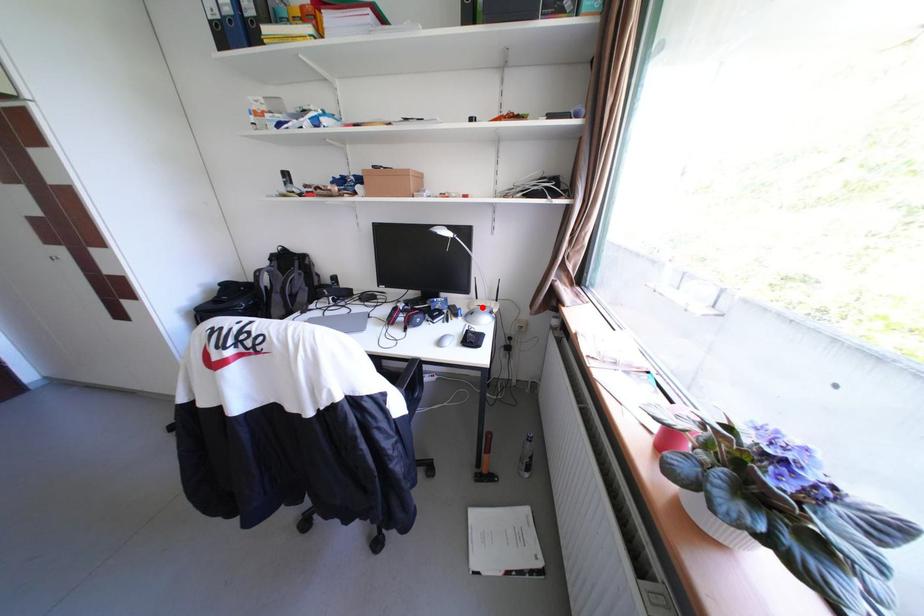
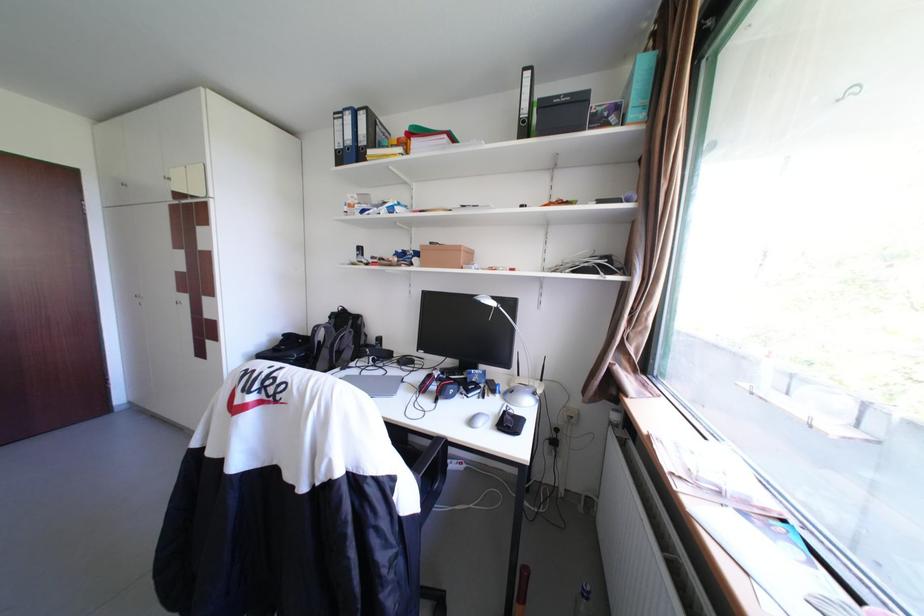
Locate, in the second image, the point that corresponds to the highlighted location in the first image.

(523, 386)